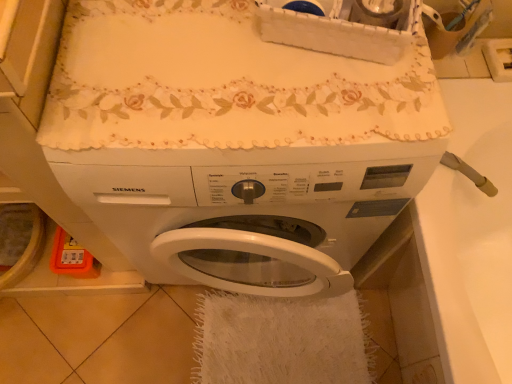
This screenshot has height=384, width=512. In order to click on free space to the left of white fluffy bath towel at lower center in this screenshot , I will do `click(144, 337)`.